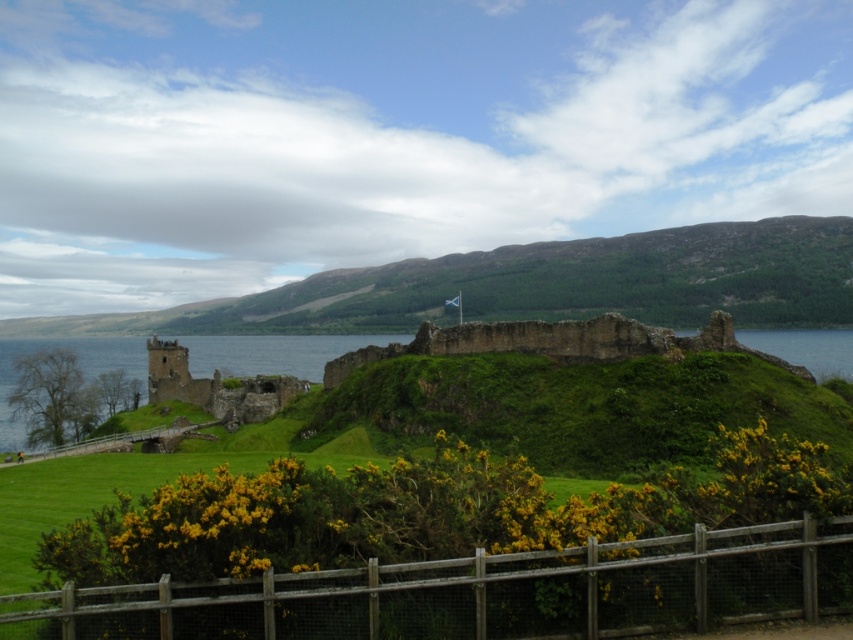
Question: Can you confirm if wooden fence at lower center is positioned to the right of green grassy hillside at center?

Choices:
 (A) yes
 (B) no

Answer: (A)

Question: Which point is farther to the camera?

Choices:
 (A) wooden fence at lower center
 (B) green grassy at center
 (C) brown stone ruins at center

Answer: (C)

Question: Which of the following is the farthest from the observer?

Choices:
 (A) green grassy at center
 (B) wooden fence at lower center

Answer: (A)

Question: Does green grassy hillside at center appear on the right side of green grassy at center?

Choices:
 (A) no
 (B) yes

Answer: (A)

Question: Is wooden fence at lower center below brown stone ruins at center?

Choices:
 (A) no
 (B) yes

Answer: (B)

Question: Which object is the closest to the green grassy hillside at center?

Choices:
 (A) green grassy at center
 (B) wooden fence at lower center

Answer: (A)